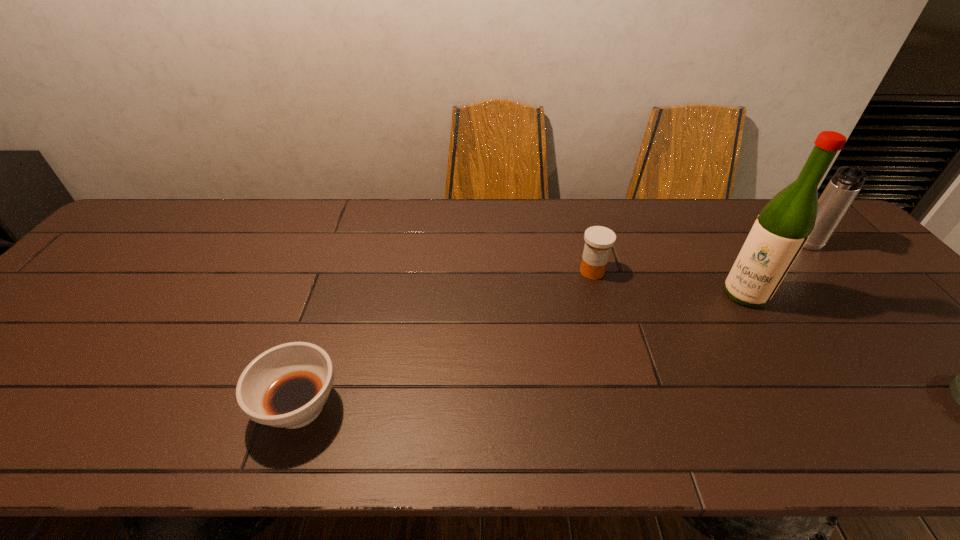
Locate an element on the screen. This screenshot has height=540, width=960. object at the right edge is located at coordinates (844, 186).

Locate an element on the screen. This screenshot has height=540, width=960. object present at the far right corner is located at coordinates (844, 186).

At what (x,y) coordinates should I click in order to perform the action: click on vacant space at the far edge of the desktop. Please return your answer as a coordinate pair (x, y). The image size is (960, 540). Looking at the image, I should click on (616, 215).

In the image, there is a desktop. Where is `free space at the near edge`? The width and height of the screenshot is (960, 540). free space at the near edge is located at coordinates (430, 407).

At what (x,y) coordinates should I click in order to perform the action: click on vacant space at the right edge. Please return your answer as a coordinate pair (x, y). Looking at the image, I should click on pyautogui.click(x=890, y=282).

Locate an element on the screen. empty space that is in between the third shortest object and the third object from right to left is located at coordinates (669, 282).

Image resolution: width=960 pixels, height=540 pixels. What are the coordinates of `vacant point located between the third object from right to left and the leftmost object` in the screenshot? It's located at (522, 350).

Where is `vacant area that lies between the second shortest object and the thermos bottle`? The height and width of the screenshot is (540, 960). vacant area that lies between the second shortest object and the thermos bottle is located at coordinates (553, 327).

Choose which object is the second nearest neighbor to the shortest object. Please provide its 2D coordinates. Your answer should be formatted as a tuple, i.e. [(x, y)], where the tuple contains the x and y coordinates of a point satisfying the conditions above.

[(844, 186)]

Select which object appears as the fourth closest to the fourth shortest object. Please provide its 2D coordinates. Your answer should be formatted as a tuple, i.e. [(x, y)], where the tuple contains the x and y coordinates of a point satisfying the conditions above.

[(286, 386)]